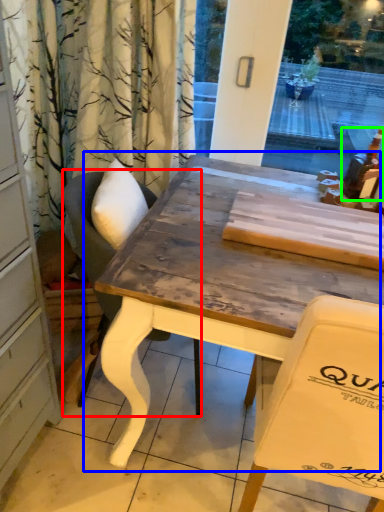
Question: Considering the real-world distances, which object is farthest from chair (highlighted by a red box)? table (highlighted by a blue box) or alcohol (highlighted by a green box)?

Choices:
 (A) table
 (B) alcohol

Answer: (B)